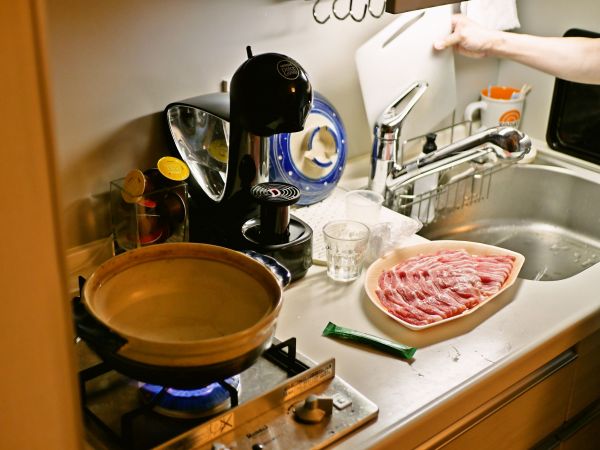
Locate an element on the screen. This screenshot has width=600, height=450. edge of counter is located at coordinates (477, 388).